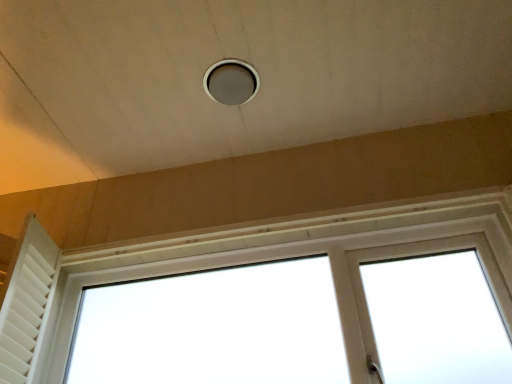
Question: Should I look upward or downward to see matte gray hole at center?

Choices:
 (A) up
 (B) down

Answer: (A)

Question: From a real-world perspective, is matte gray hole at center located beneath white plastic window at center?

Choices:
 (A) no
 (B) yes

Answer: (A)

Question: Is matte gray hole at center completely or partially outside of white plastic window at center?

Choices:
 (A) no
 (B) yes

Answer: (B)

Question: From the image's perspective, would you say matte gray hole at center is shown under white plastic window at center?

Choices:
 (A) no
 (B) yes

Answer: (A)

Question: Can you confirm if matte gray hole at center is shorter than white plastic window at center?

Choices:
 (A) no
 (B) yes

Answer: (B)

Question: Considering the relative sizes of matte gray hole at center and white plastic window at center in the image provided, is matte gray hole at center thinner than white plastic window at center?

Choices:
 (A) no
 (B) yes

Answer: (B)

Question: Does matte gray hole at center lie behind white plastic window at center?

Choices:
 (A) no
 (B) yes

Answer: (B)

Question: From the image's perspective, is white matte shutter at left beneath white plastic window at center?

Choices:
 (A) yes
 (B) no

Answer: (B)

Question: Is white matte shutter at left wider than white plastic window at center?

Choices:
 (A) no
 (B) yes

Answer: (B)

Question: Is white matte shutter at left aimed at white plastic window at center?

Choices:
 (A) no
 (B) yes

Answer: (A)

Question: Considering the relative sizes of white matte shutter at left and white plastic window at center in the image provided, is white matte shutter at left shorter than white plastic window at center?

Choices:
 (A) no
 (B) yes

Answer: (B)

Question: Is the position of white matte shutter at left more distant than that of white plastic window at center?

Choices:
 (A) yes
 (B) no

Answer: (A)

Question: From a real-world perspective, is white matte shutter at left located higher than white plastic window at center?

Choices:
 (A) no
 (B) yes

Answer: (B)

Question: From a real-world perspective, does matte gray hole at center stand above white matte shutter at left?

Choices:
 (A) no
 (B) yes

Answer: (B)